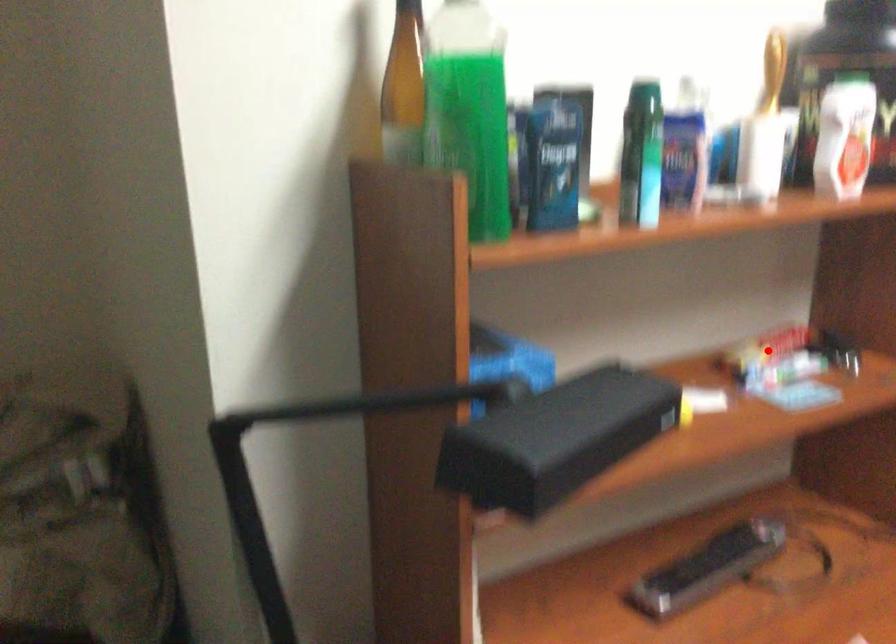
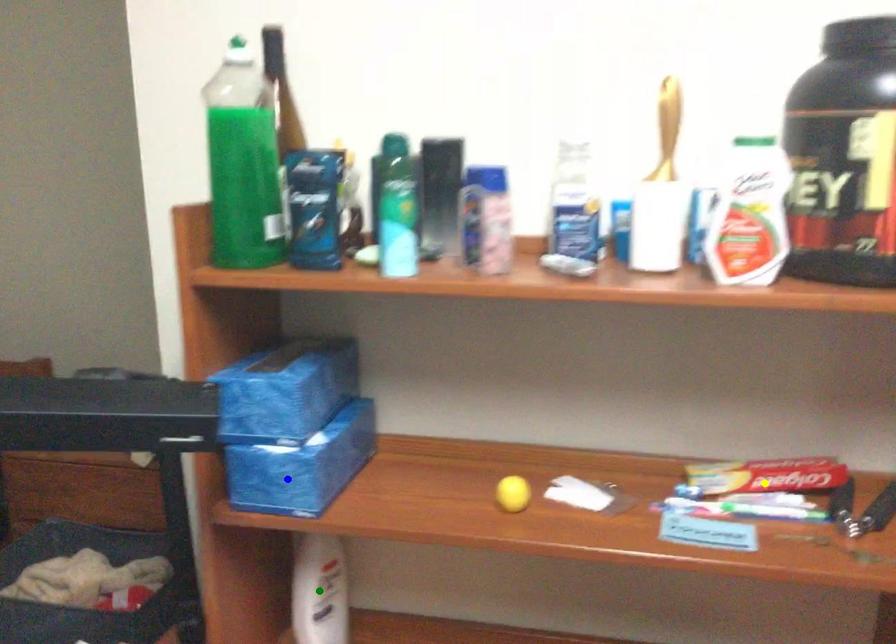
Question: I am providing you with two images of the same scene from different viewpoints. A red point is marked on the first image. You are given multiple points on the second image. Which mark in image 2 goes with the point in image 1?

Choices:
 (A) blue point
 (B) yellow point
 (C) green point

Answer: (B)